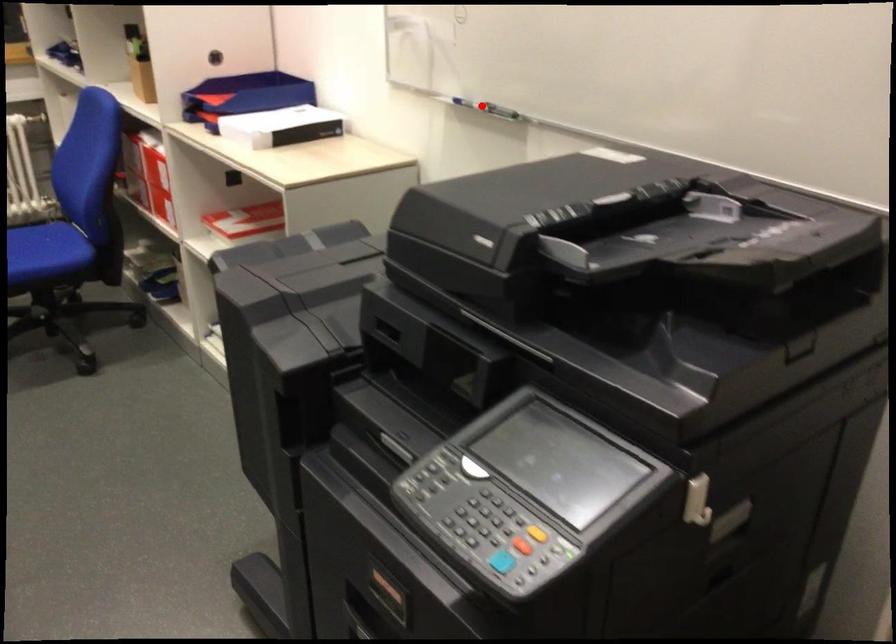
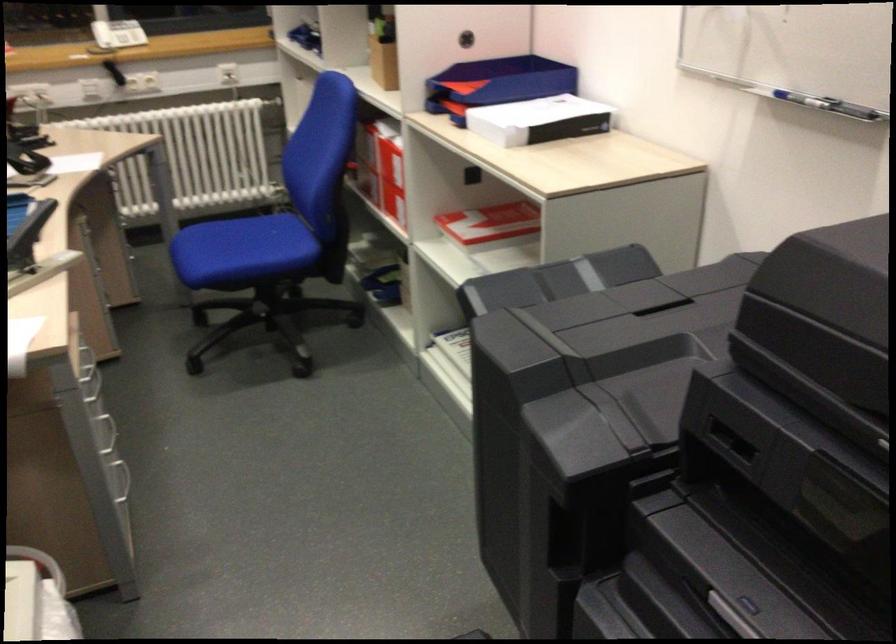
The point at the highlighted location is marked in the first image. Where is the corresponding point in the second image?

(820, 102)